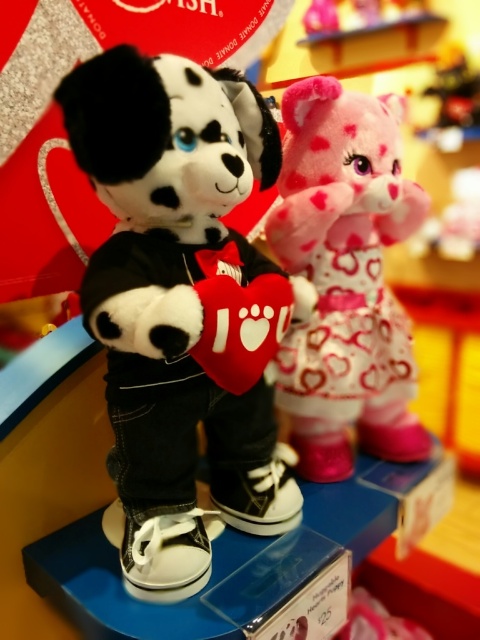
Is point (139, 64) less distant than point (297, 228)?

That is True.

The height and width of the screenshot is (640, 480). What do you see at coordinates (182, 305) in the screenshot? I see `soft plush dog at center` at bounding box center [182, 305].

Identify the location of soft plush dog at center. (182, 305).